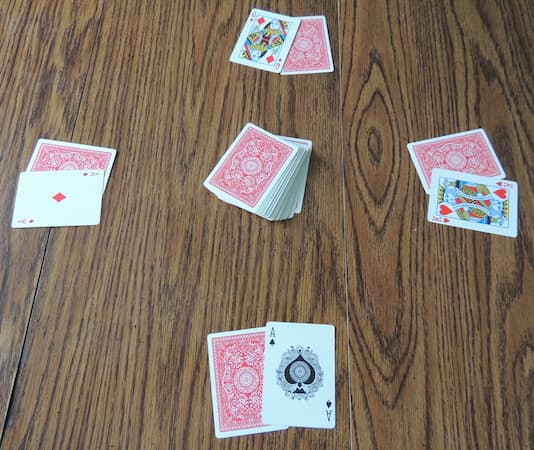
Locate an element on the screen. table is located at coordinates (245, 263).